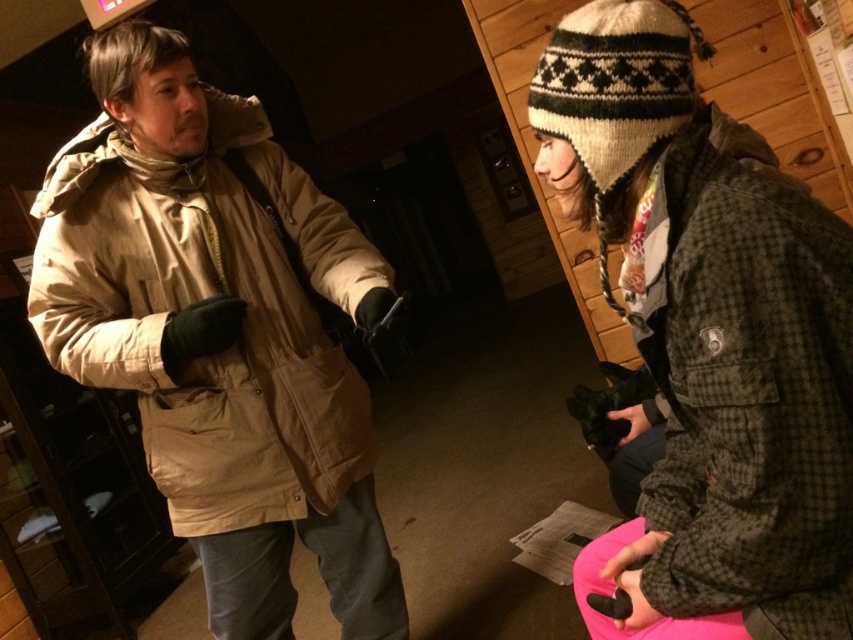
You are standing in the room and want to know the exact coordinates of the beige cotton jacket at left. What are its coordinates?

The beige cotton jacket at left is located at point [219,333].

You are a photographer trying to capture a portrait of the two people in the scene. You want to ensure both the beige cotton jacket at left and the knitted woolen hat at upper right are clearly visible in the frame. Based on their positions, which direction should you adjust your camera to focus on both subjects?

The beige cotton jacket at left is positioned on the left side of the knitted woolen hat at upper right, so you should position your camera to the right side of the scene to ensure both subjects are in frame.